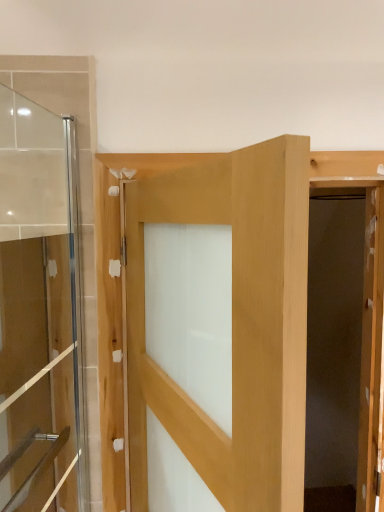
Question: In which direction should I rotate to look at natural wood door at center, the second door from the left?

Choices:
 (A) right
 (B) left

Answer: (B)

Question: Is natural wood door at center, the second door from the left, next to transparent glass door at left, which is the 2th door from right to left, and touching it?

Choices:
 (A) yes
 (B) no

Answer: (B)

Question: Is natural wood door at center, the second door from the left, looking in the opposite direction of transparent glass door at left, the 1th door in the left-to-right sequence?

Choices:
 (A) no
 (B) yes

Answer: (B)

Question: Is natural wood door at center, the first door when ordered from right to left, at the right side of transparent glass door at left, which is the 2th door from right to left?

Choices:
 (A) yes
 (B) no

Answer: (A)

Question: Considering the relative sizes of natural wood door at center, the first door when ordered from right to left, and transparent glass door at left, which is the 2th door from right to left, in the image provided, is natural wood door at center, the first door when ordered from right to left, taller than transparent glass door at left, which is the 2th door from right to left,?

Choices:
 (A) yes
 (B) no

Answer: (B)

Question: From the image's perspective, would you say natural wood door at center, the second door from the left, is shown under transparent glass door at left, which is the 2th door from right to left?

Choices:
 (A) yes
 (B) no

Answer: (A)

Question: From the image's perspective, does natural wood door at center, the second door from the left, appear higher than transparent glass door at left, which is the 2th door from right to left?

Choices:
 (A) yes
 (B) no

Answer: (B)

Question: From a real-world perspective, is transparent glass door at left, which is the 2th door from right to left, physically below natural wood door at center, the first door when ordered from right to left?

Choices:
 (A) no
 (B) yes

Answer: (A)

Question: Is transparent glass door at left, which is the 2th door from right to left, with natural wood door at center, the first door when ordered from right to left?

Choices:
 (A) no
 (B) yes

Answer: (A)

Question: Would you say transparent glass door at left, the 1th door in the left-to-right sequence, is outside natural wood door at center, the second door from the left?

Choices:
 (A) no
 (B) yes

Answer: (B)

Question: Is natural wood door at center, the first door when ordered from right to left, at the back of transparent glass door at left, which is the 2th door from right to left?

Choices:
 (A) no
 (B) yes

Answer: (B)

Question: Can you confirm if transparent glass door at left, which is the 2th door from right to left, is bigger than natural wood door at center, the first door when ordered from right to left?

Choices:
 (A) no
 (B) yes

Answer: (A)

Question: Does transparent glass door at left, which is the 2th door from right to left, have a greater height compared to natural wood door at center, the second door from the left?

Choices:
 (A) no
 (B) yes

Answer: (B)

Question: Based on their positions, is natural wood door at center, the first door when ordered from right to left, located to the left or right of transparent glass door at left, the 1th door in the left-to-right sequence?

Choices:
 (A) right
 (B) left

Answer: (A)